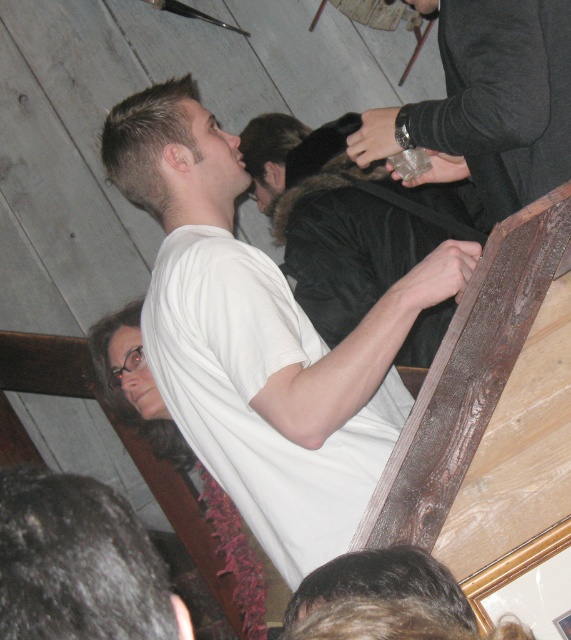
Question: Which point is farther to the camera?

Choices:
 (A) (120, 324)
 (B) (444, 109)

Answer: (A)

Question: Is short blonde hair at upper left above dark brown hair at lower left?

Choices:
 (A) no
 (B) yes

Answer: (B)

Question: Is dark curly hair at lower left thinner than dark brown hair at lower left?

Choices:
 (A) no
 (B) yes

Answer: (B)

Question: Considering the real-world distances, which object is farthest from the black fur-lined coat at upper center?

Choices:
 (A) white matte t-shirt at center
 (B) dark brown fur at upper center

Answer: (A)

Question: Which object appears closest to the camera in this image?

Choices:
 (A) dark curly hair at lower left
 (B) dark brown hair at lower left

Answer: (A)

Question: In this image, where is white matte t-shirt at center located relative to translucent glass cup at upper right?

Choices:
 (A) below
 (B) above

Answer: (A)